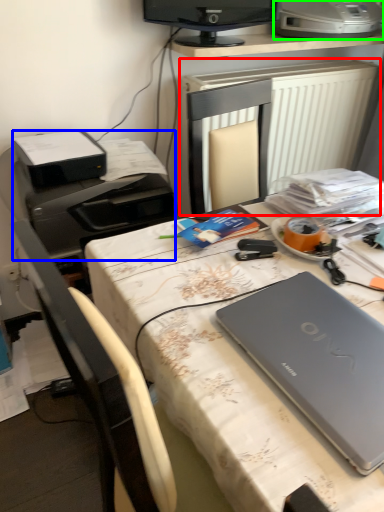
Question: Which object is positioned closest to radiator (highlighted by a red box)? Select from printer (highlighted by a blue box) and printer (highlighted by a green box).

Choices:
 (A) printer
 (B) printer

Answer: (B)